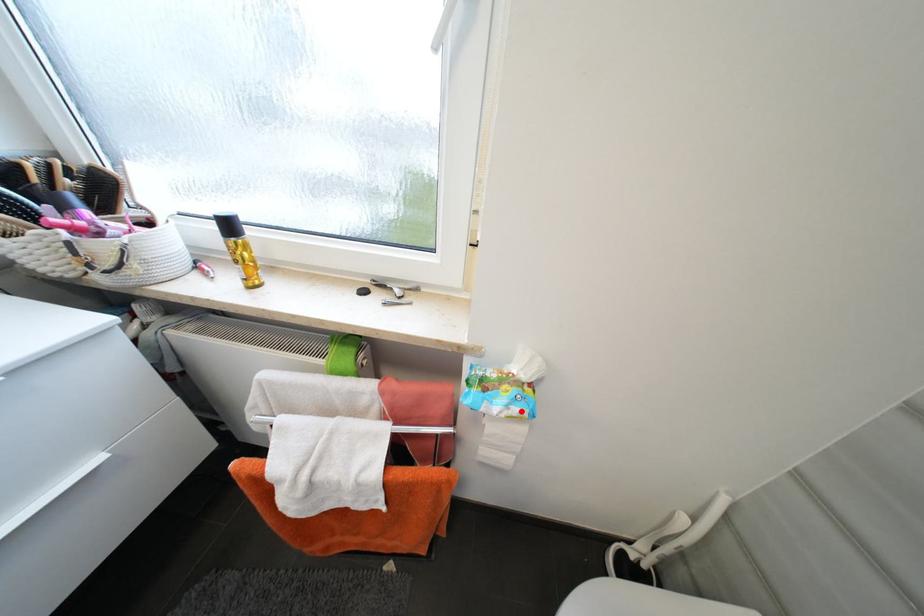
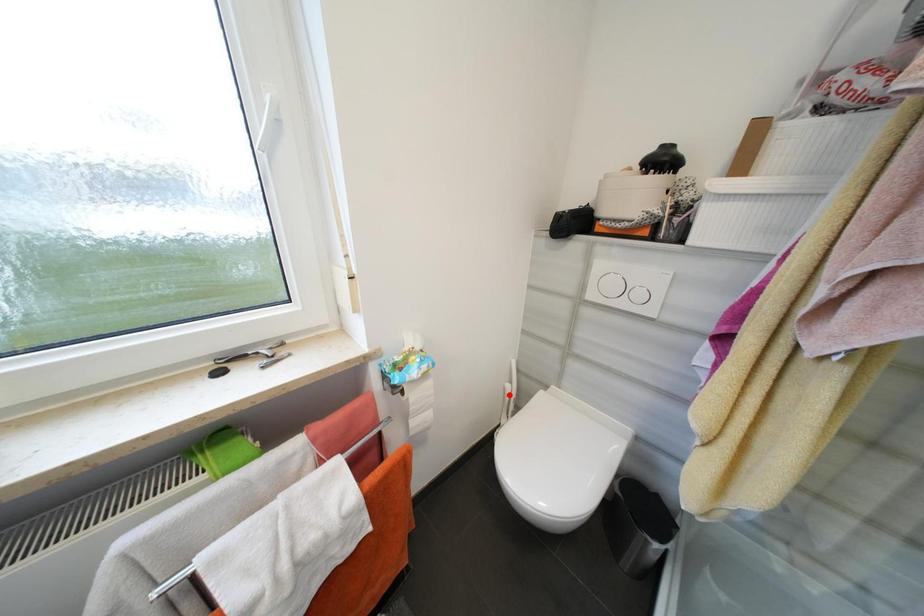
I am providing you with two images of the same scene from different viewpoints. A red point is marked on the first image and another point is marked on the second image. Does the point marked in image1 correspond to the same location as the one in image2?

No